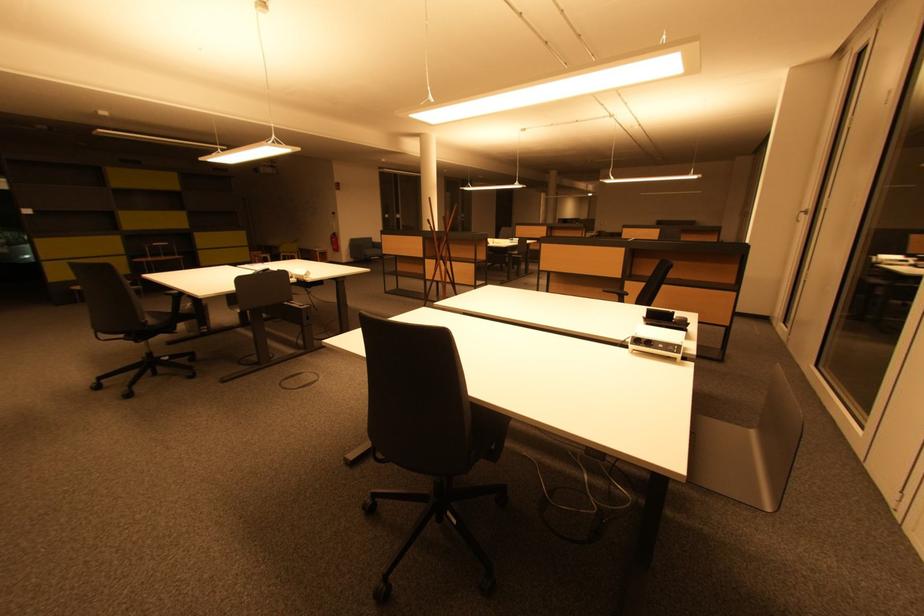
Where would you lift the phone handset? Please return your answer as a coordinate pair (x, y).

(664, 318)